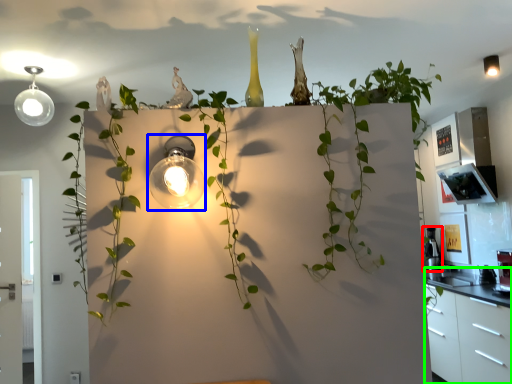
Question: Which object is the closest to the appliance (highlighted by a red box)? Choose among these: light fixture (highlighted by a blue box) or dresser (highlighted by a green box).

Choices:
 (A) light fixture
 (B) dresser

Answer: (B)